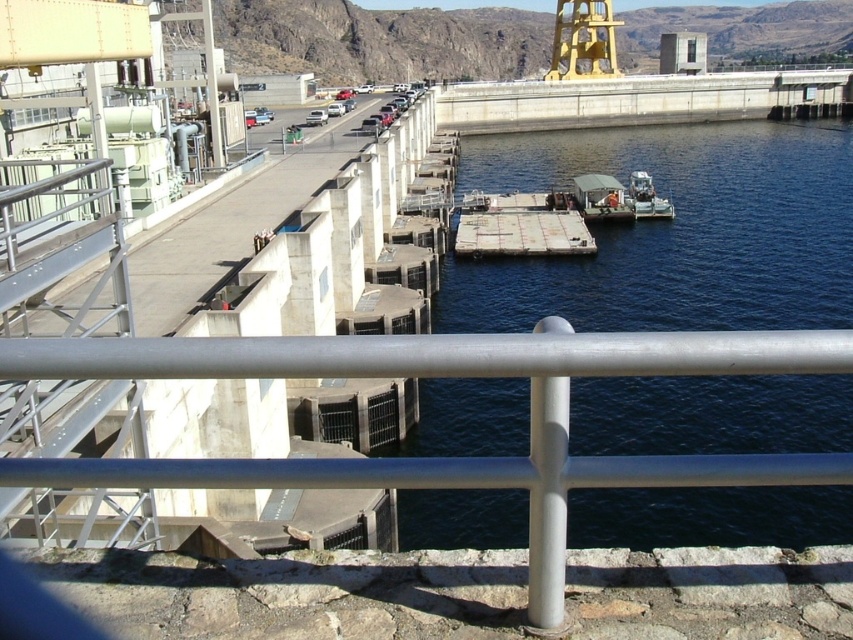
You are standing on the observation deck of the hydroelectric dam and notice the blue water at center. Can you determine its exact location in the image using coordinates?

The blue water at center is located at point coordinates of (x=672, y=230), so its exact position can be identified using those coordinates.

You are a safety inspector on the dam and need to check the equipment on both the white matte boat at center and the white plastic boat at center. Which boat is located directly above the other?

The white plastic boat at center is directly above the white matte boat at center because the white matte boat at center is positioned under the white plastic boat at center.